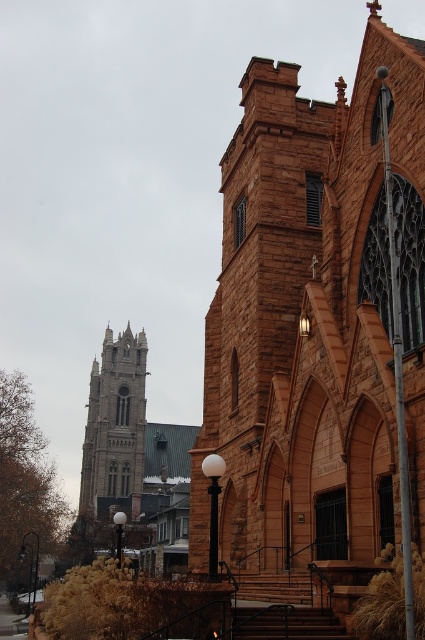
In the scene shown: You are standing in a field and see the brown stone church at center and the stone gothic tower at upper left. Which one appears closer to you?

The brown stone church at center appears closer because it is in front of the stone gothic tower at upper left.

You are an architect analyzing the spatial composition of the image. Which object takes up more visual space in the scene between the brown stone church at center and the stone gothic tower at upper left?

The stone gothic tower at upper left occupies more visual space than the brown stone church at center according to the description provided.

You are an architect planning to build a new structure between the brown stone church at center and the stone gothic tower at upper left. Based on their widths, which one should you consider for alignment purposes to ensure the new structure fits properly?

The brown stone church at center has a smaller width compared to the stone gothic tower at upper left. Therefore, aligning the new structure with the stone gothic tower at upper left would provide more space for proper fitting.